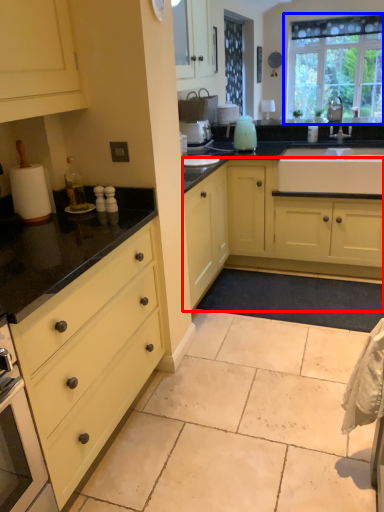
Question: Which of the following is the closest to the observer, cabinetry (highlighted by a red box) or window (highlighted by a blue box)?

Choices:
 (A) cabinetry
 (B) window

Answer: (A)